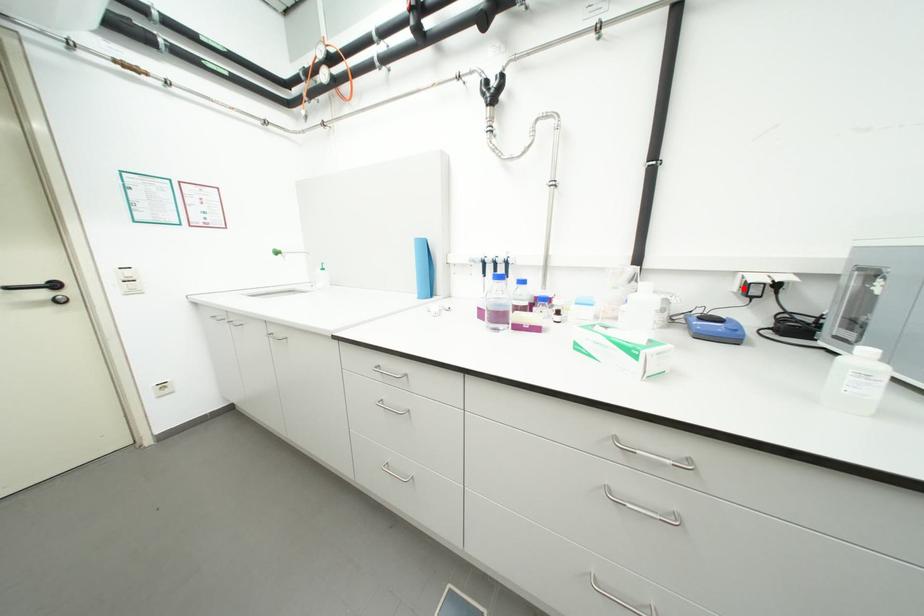
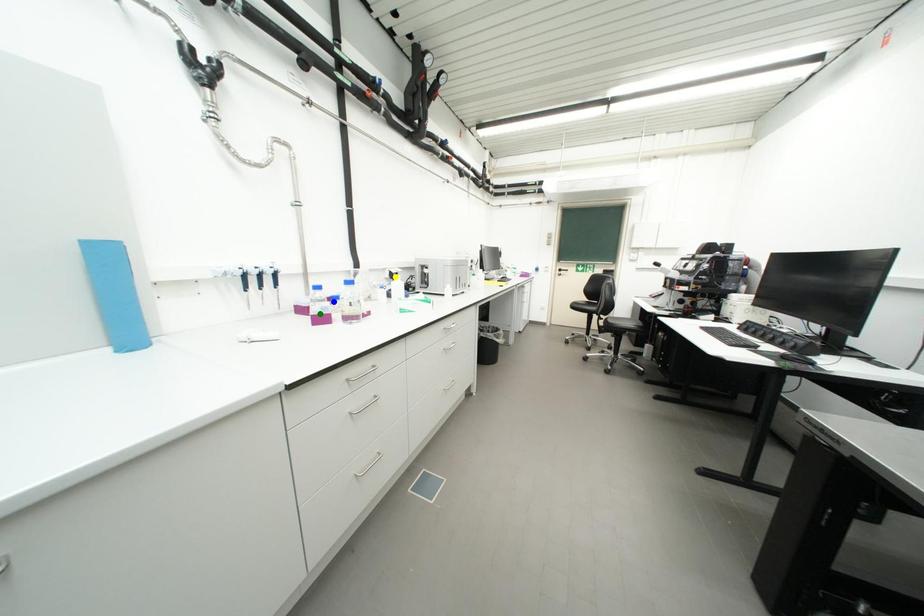
Question: I am providing you with two images of the same scene from different viewpoints. A red point is marked on the first image. You are given multiple points on the second image. In image 2, which mark is for the same physical point as the one in image 1?

Choices:
 (A) blue point
 (B) green point
 (C) yellow point

Answer: (C)